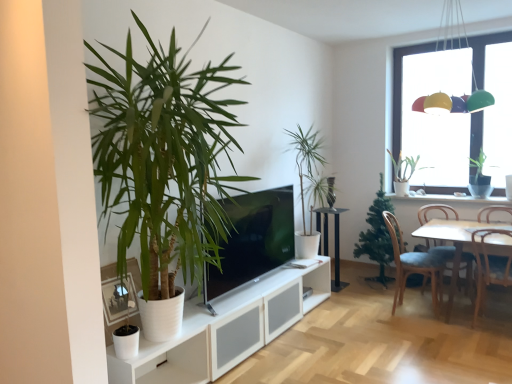
Locate an element on the screen. This screenshot has height=384, width=512. free space to the left of white wooden table at right, which is the second table from left to right is located at coordinates (392, 319).